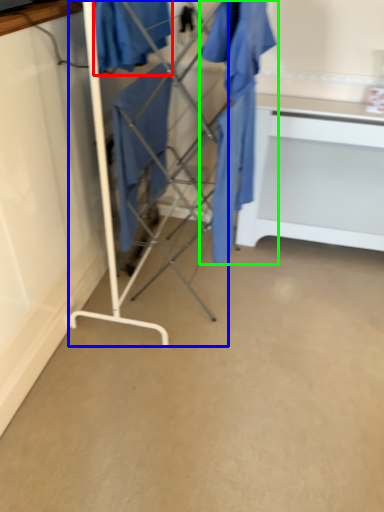
Question: Considering the real-world distances, which object is farthest from clothing (highlighted by a red box)? furniture (highlighted by a blue box) or clothing (highlighted by a green box)?

Choices:
 (A) furniture
 (B) clothing

Answer: (B)